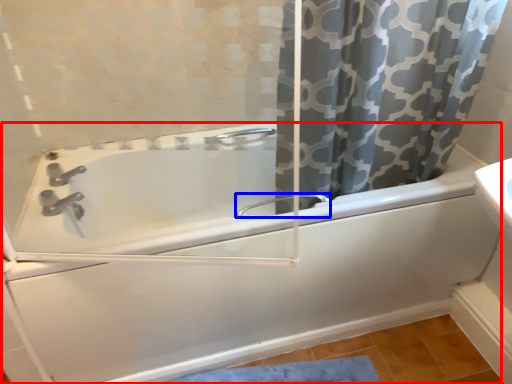
Question: Which of the following is the closest to the observer, bathtub (highlighted by a red box) or faucet (highlighted by a blue box)?

Choices:
 (A) bathtub
 (B) faucet

Answer: (A)